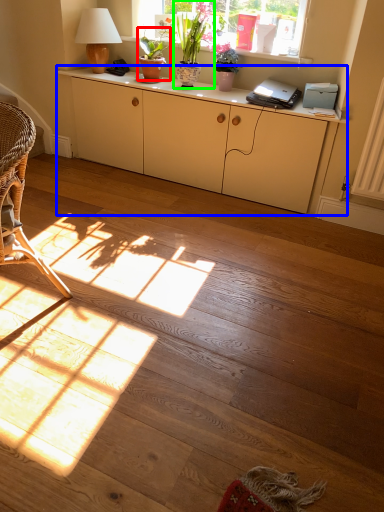
Question: Estimate the real-world distances between objects in this image. Which object is closer to houseplant (highlighted by a red box), cabinetry (highlighted by a blue box) or houseplant (highlighted by a green box)?

Choices:
 (A) cabinetry
 (B) houseplant

Answer: (B)